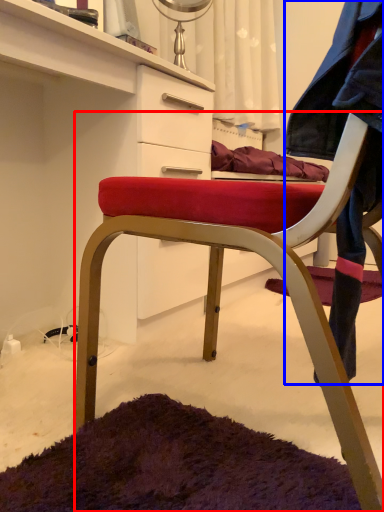
Question: Among these objects, which one is nearest to the camera, chair (highlighted by a red box) or denim jacket (highlighted by a blue box)?

Choices:
 (A) chair
 (B) denim jacket

Answer: (B)